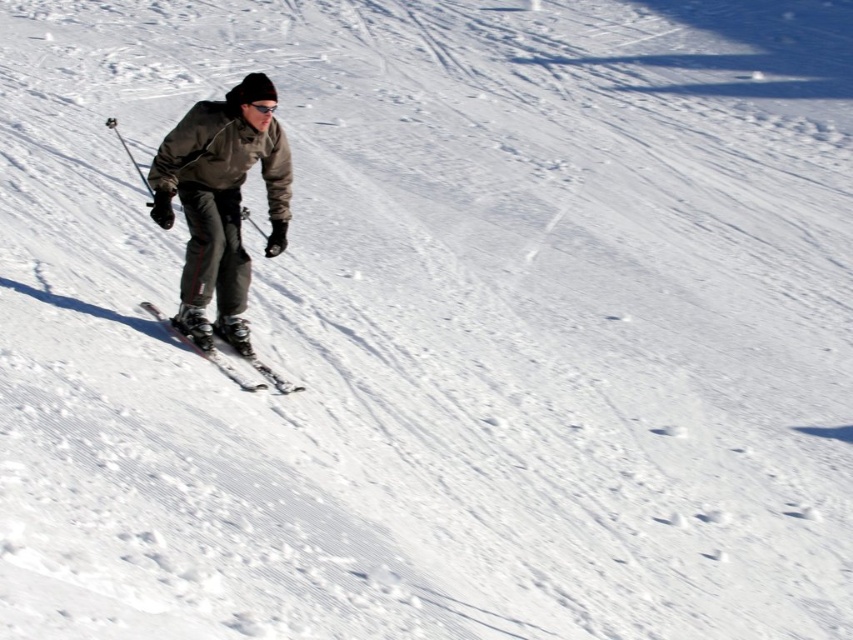
Question: Is gray softshell jacket at center bigger than metallic skis at center?

Choices:
 (A) yes
 (B) no

Answer: (A)

Question: Can you confirm if gray softshell jacket at center is wider than metallic skis at center?

Choices:
 (A) yes
 (B) no

Answer: (B)

Question: Among these objects, which one is farthest from the camera?

Choices:
 (A) metallic skis at center
 (B) gray softshell jacket at center

Answer: (A)

Question: In this image, where is gray softshell jacket at center located relative to metallic skis at center?

Choices:
 (A) left
 (B) right

Answer: (B)